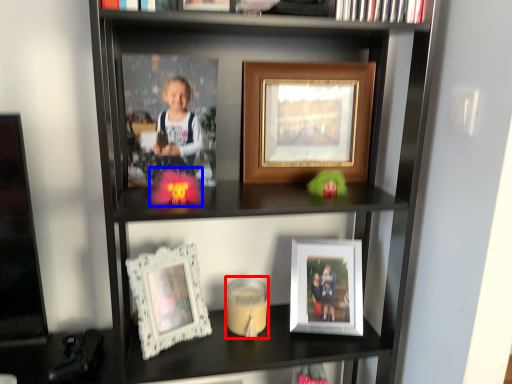
Question: Which of the following is the farthest to the observer, candle holder (highlighted by a red box) or toy (highlighted by a blue box)?

Choices:
 (A) candle holder
 (B) toy

Answer: (A)